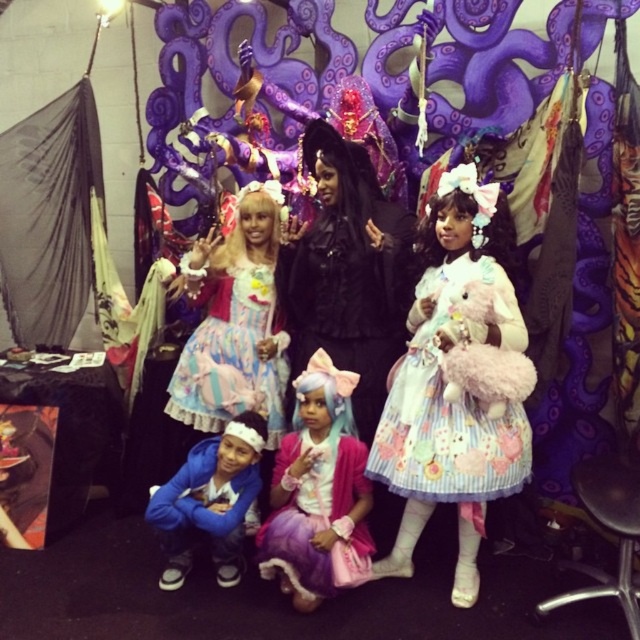
Question: Which object appears farthest from the camera in this image?

Choices:
 (A) pastel lace dress at center
 (B) pastel pink fabric dress at center
 (C) pastel striped dress at center
 (D) matte black dress at center

Answer: (A)

Question: Which of the following is the farthest from the observer?

Choices:
 (A) (256, 346)
 (B) (211, 497)
 (C) (342, 557)

Answer: (A)

Question: Which point is closer to the camera taking this photo?

Choices:
 (A) (316, 269)
 (B) (236, 531)

Answer: (B)

Question: Is pastel striped dress at center positioned at the back of pastel pink fabric dress at center?

Choices:
 (A) yes
 (B) no

Answer: (B)

Question: Does matte black dress at center have a larger size compared to pastel lace dress at center?

Choices:
 (A) yes
 (B) no

Answer: (A)

Question: Considering the relative positions of pastel lace dress at center and blue fleece jacket at lower left in the image provided, where is pastel lace dress at center located with respect to blue fleece jacket at lower left?

Choices:
 (A) right
 (B) left

Answer: (A)